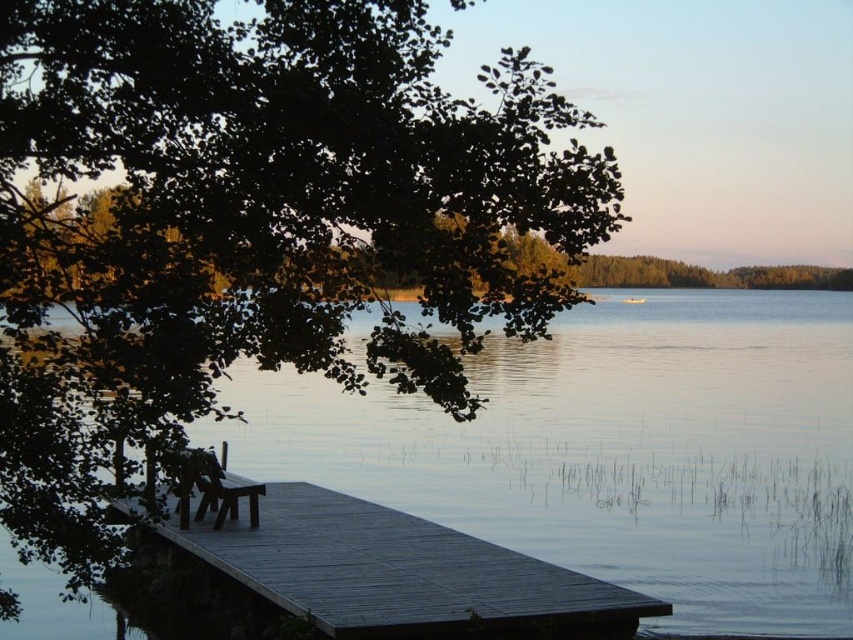
Does green leafy tree at upper left appear under wooden bench at lower left?

No, green leafy tree at upper left is not below wooden bench at lower left.

Is green leafy tree at upper left positioned at the back of wooden bench at lower left?

No, it is in front of wooden bench at lower left.

Does point (488, 125) lie behind point (225, 506)?

No, it is not.

Identify the location of green leafy tree at upper left. (253, 221).

Can you confirm if transparent water at center is bigger than wooden bench at lower left?

Yes, transparent water at center is bigger than wooden bench at lower left.

Can you confirm if transparent water at center is wider than wooden bench at lower left?

Indeed, transparent water at center has a greater width compared to wooden bench at lower left.

This screenshot has height=640, width=853. What do you see at coordinates (614, 451) in the screenshot?
I see `transparent water at center` at bounding box center [614, 451].

Identify the location of transparent water at center. The height and width of the screenshot is (640, 853). (614, 451).

Which is behind, point (612, 212) or point (299, 484)?

Point (299, 484)

Who is lower down, green leafy tree at upper left or dark wood dock at lower left?

dark wood dock at lower left

Locate an element on the screen. The height and width of the screenshot is (640, 853). green leafy tree at upper left is located at coordinates (253, 221).